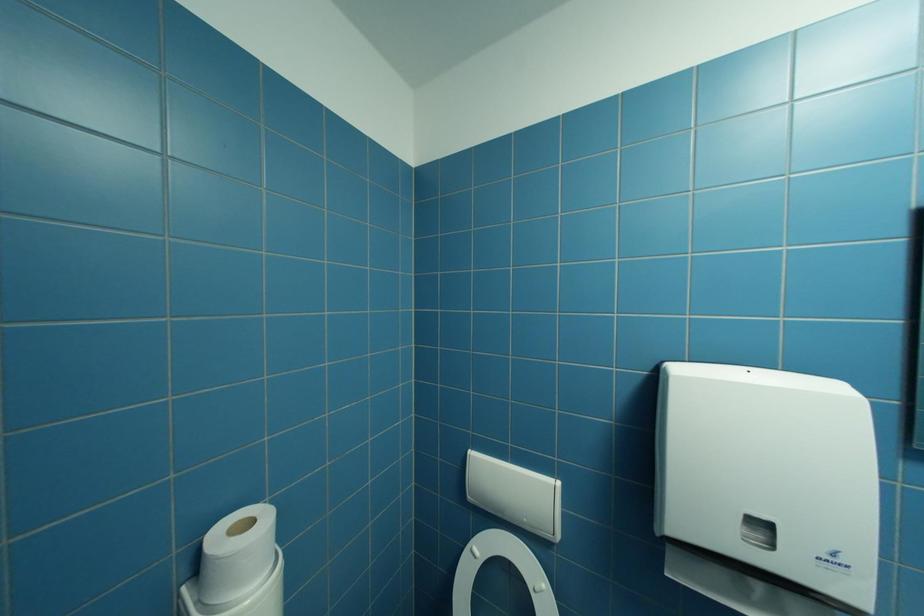
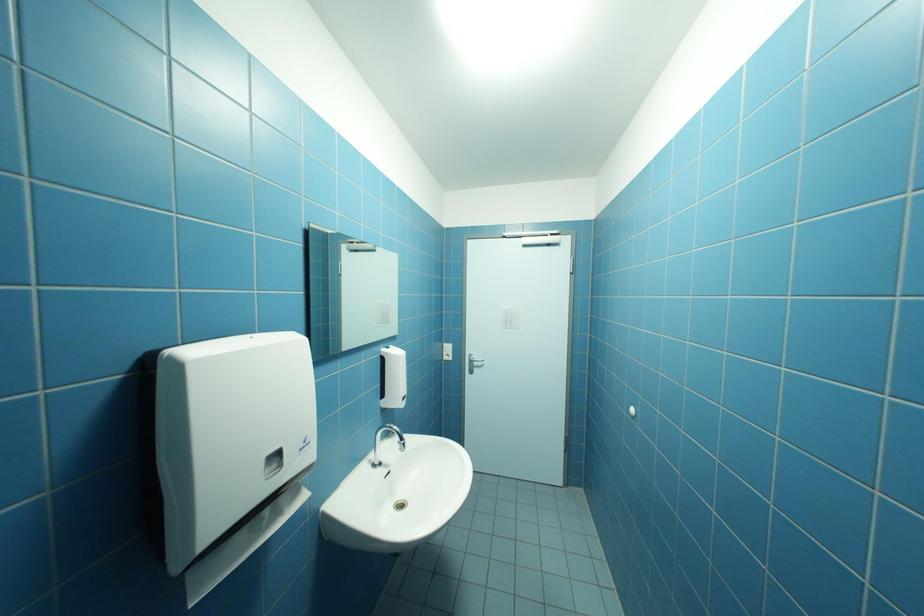
Question: The first image is from the beginning of the video and the second image is from the end. How did the camera likely rotate when shooting the video?

Choices:
 (A) Left
 (B) Right
 (C) Up
 (D) Down

Answer: (B)